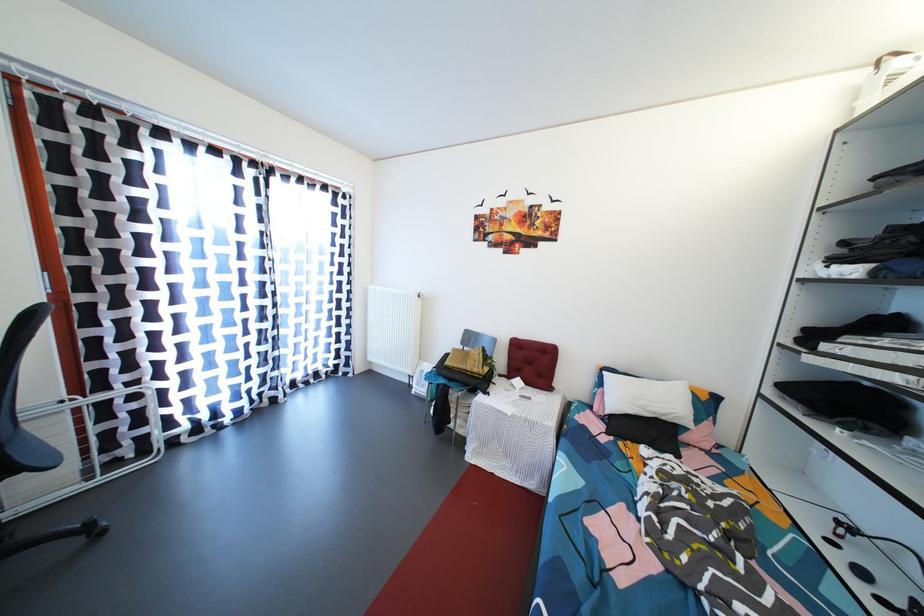
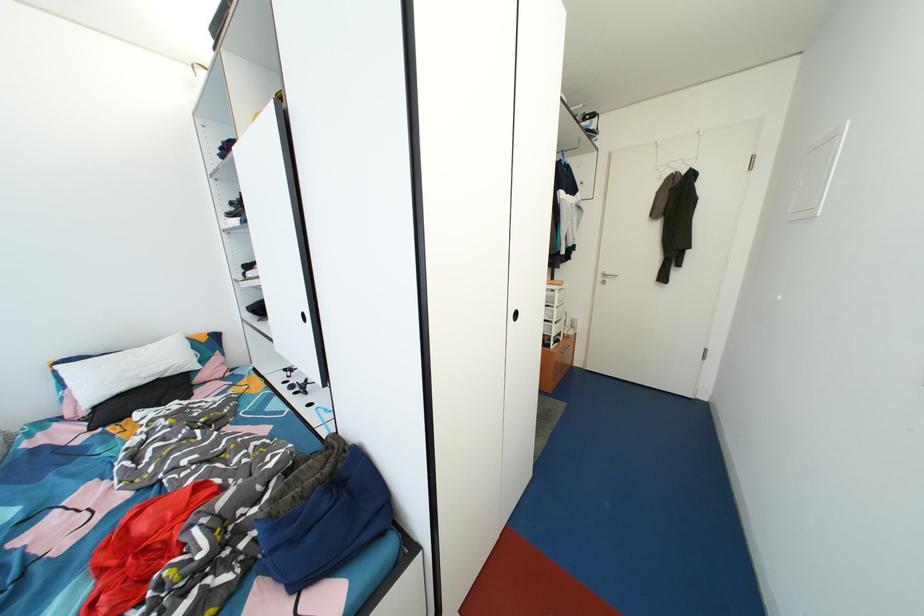
Question: I am providing you with two images of the same scene from different viewpoints. Please identify which objects are invisible in image2.

Choices:
 (A) black recessed handle
 (B) silver door handle
 (C) blue clothes hanger
 (D) none of these

Answer: (D)